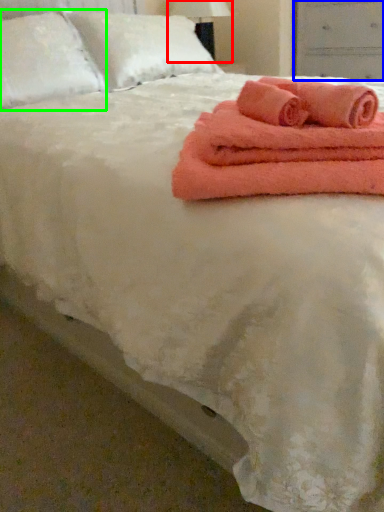
Question: Considering the real-world distances, which object is farthest from bedside lamp (highlighted by a red box)? drawer (highlighted by a blue box) or pillow (highlighted by a green box)?

Choices:
 (A) drawer
 (B) pillow

Answer: (B)